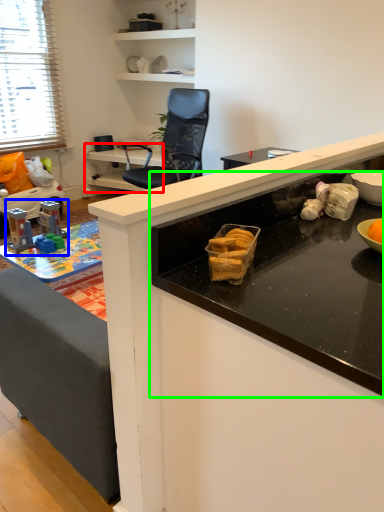
Question: Estimate the real-world distances between objects in this image. Which object is closer to table (highlighted by a red box), toy (highlighted by a blue box) or countertop (highlighted by a green box)?

Choices:
 (A) toy
 (B) countertop

Answer: (A)